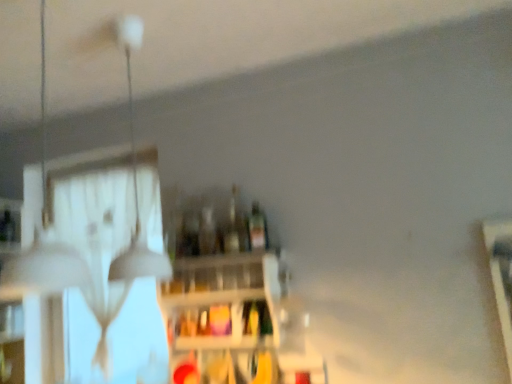
Looking at this image, what is the approximate width of white matte lampshade at upper left, which appears as the 1th lamp when viewed from the front?

Answer: The width of white matte lampshade at upper left, which appears as the 1th lamp when viewed from the front, is 9.92 inches.

The height and width of the screenshot is (384, 512). What do you see at coordinates (42, 270) in the screenshot? I see `white matte lampshade at upper left, which appears as the 1th lamp when viewed from the front` at bounding box center [42, 270].

In order to face transparent glass bottle at center, arranged as the second bottle when viewed from the right, should I rotate leftwards or rightwards?

It's best to rotate left around 2.896 degrees.

Describe the element at coordinates (234, 228) in the screenshot. This screenshot has width=512, height=384. I see `transparent glass bottle at center, acting as the 2th bottle starting from the left` at that location.

The height and width of the screenshot is (384, 512). I want to click on translucent glass bottle at center, positioned as the 3th bottle in left-to-right order, so click(257, 228).

The width and height of the screenshot is (512, 384). Describe the element at coordinates (257, 228) in the screenshot. I see `translucent glass bottle at center, which is counted as the first bottle, starting from the right` at that location.

What is the approximate height of transparent glass door at upper left?

3.78 feet.

The image size is (512, 384). Identify the location of white matte lampshade at upper left, the first lamp viewed from the back. coord(135,179).

In the scene shown: Is translucent glass bottle at center, which appears as the 3th bottle when viewed from the right, bigger or smaller than white matte lampshade at upper left, which is the 2th lamp from front to back?

In the image, translucent glass bottle at center, which appears as the 3th bottle when viewed from the right, appears to be smaller than white matte lampshade at upper left, which is the 2th lamp from front to back.

Could you tell me if translucent glass bottle at center, the 1th bottle when ordered from left to right, is turned towards white matte lampshade at upper left, the first lamp viewed from the back?

Yes, translucent glass bottle at center, the 1th bottle when ordered from left to right, faces towards white matte lampshade at upper left, the first lamp viewed from the back.

Between translucent glass bottle at center, the 1th bottle when ordered from left to right, and white matte lampshade at upper left, the first lamp viewed from the back, which one is positioned behind?

translucent glass bottle at center, the 1th bottle when ordered from left to right, is further away from the camera.

Can you tell me how much translucent glass bottle at center, the 1th bottle when ordered from left to right, and white matte lampshade at upper left, the first lamp viewed from the back, differ in facing direction?

82 degrees separate the facing orientations of translucent glass bottle at center, the 1th bottle when ordered from left to right, and white matte lampshade at upper left, the first lamp viewed from the back.

Could you tell me if translucent glass bottle at center, which is counted as the first bottle, starting from the right, is turned towards transparent glass door at upper left?

No, translucent glass bottle at center, which is counted as the first bottle, starting from the right, is not aimed at transparent glass door at upper left.

From a real-world perspective, is translucent glass bottle at center, which is counted as the first bottle, starting from the right, physically located above or below transparent glass door at upper left?

In terms of real-world spatial position, translucent glass bottle at center, which is counted as the first bottle, starting from the right, is above transparent glass door at upper left.

Considering the positions of objects translucent glass bottle at center, positioned as the 3th bottle in left-to-right order, and transparent glass door at upper left in the image provided, who is in front, translucent glass bottle at center, positioned as the 3th bottle in left-to-right order, or transparent glass door at upper left?

translucent glass bottle at center, positioned as the 3th bottle in left-to-right order, is more forward.

Considering the positions of points (266, 239) and (121, 369), is point (266, 239) farther from camera compared to point (121, 369)?

No.

Is matte yellow glass at center inside transparent glass door at upper left?

No, matte yellow glass at center is located outside of transparent glass door at upper left.

How distant is transparent glass door at upper left from matte yellow glass at center?

transparent glass door at upper left is 28.64 inches away from matte yellow glass at center.

Who is taller, transparent glass door at upper left or matte yellow glass at center?

transparent glass door at upper left.

Is transparent glass door at upper left oriented away from matte yellow glass at center?

No, transparent glass door at upper left is not facing the opposite direction of matte yellow glass at center.

Does white matte lampshade at upper left, which is the 2th lamp from front to back, turn towards translucent glass bottle at center, which is counted as the first bottle, starting from the right?

No, white matte lampshade at upper left, which is the 2th lamp from front to back, is not facing towards translucent glass bottle at center, which is counted as the first bottle, starting from the right.

How different are the orientations of white matte lampshade at upper left, which is the 2th lamp from front to back, and translucent glass bottle at center, which is counted as the first bottle, starting from the right, in degrees?

82 degrees separate the facing orientations of white matte lampshade at upper left, which is the 2th lamp from front to back, and translucent glass bottle at center, which is counted as the first bottle, starting from the right.

Considering the relative sizes of white matte lampshade at upper left, which is the 2th lamp from front to back, and translucent glass bottle at center, which is counted as the first bottle, starting from the right, in the image provided, is white matte lampshade at upper left, which is the 2th lamp from front to back, taller than translucent glass bottle at center, which is counted as the first bottle, starting from the right,?

Yes, white matte lampshade at upper left, which is the 2th lamp from front to back, is taller than translucent glass bottle at center, which is counted as the first bottle, starting from the right.

You are a GUI agent. You are given a task and a screenshot of the screen. Output one action in this format:
    pyautogui.click(x=<x>, y=<y>)
    Task: Click on the 2nd bottle behind when counting from the white matte lampshade at upper left, the first lamp viewed from the back
    This screenshot has height=384, width=512.
    Given the screenshot: What is the action you would take?
    pyautogui.click(x=257, y=228)

Considering their positions, is translucent glass bottle at center, positioned as the 3th bottle in left-to-right order, located in front of or behind matte yellow glass at center?

Visually, translucent glass bottle at center, positioned as the 3th bottle in left-to-right order, is located behind matte yellow glass at center.

Does translucent glass bottle at center, which is counted as the first bottle, starting from the right, have a greater width compared to matte yellow glass at center?

Correct, the width of translucent glass bottle at center, which is counted as the first bottle, starting from the right, exceeds that of matte yellow glass at center.

Which of these two, translucent glass bottle at center, positioned as the 3th bottle in left-to-right order, or matte yellow glass at center, is smaller?

With smaller size is matte yellow glass at center.

How many degrees apart are the facing directions of translucent glass bottle at center, positioned as the 3th bottle in left-to-right order, and matte yellow glass at center?

The angular difference between translucent glass bottle at center, positioned as the 3th bottle in left-to-right order, and matte yellow glass at center is 4.42 degrees.

Is transparent glass door at upper left bigger or smaller than white matte lampshade at upper left, the first lamp viewed from the back?

Considering their sizes, transparent glass door at upper left takes up more space than white matte lampshade at upper left, the first lamp viewed from the back.

Between transparent glass door at upper left and white matte lampshade at upper left, the first lamp viewed from the back, which one has more height?

transparent glass door at upper left.

From a real-world perspective, is transparent glass door at upper left positioned under white matte lampshade at upper left, which is the 2th lamp from front to back, based on gravity?

Correct, in the physical world, transparent glass door at upper left is lower than white matte lampshade at upper left, which is the 2th lamp from front to back.

Is transparent glass door at upper left inside the boundaries of white matte lampshade at upper left, the first lamp viewed from the back, or outside?

transparent glass door at upper left is not inside white matte lampshade at upper left, the first lamp viewed from the back, it's outside.

Choose the correct answer: Is white matte lampshade at upper left, which appears as the 1th lamp when viewed from the front, inside translucent glass bottle at center, the 1th bottle when ordered from left to right, or outside it?

white matte lampshade at upper left, which appears as the 1th lamp when viewed from the front, is outside translucent glass bottle at center, the 1th bottle when ordered from left to right.

This screenshot has height=384, width=512. I want to click on the 1st bottle to the right of the white matte lampshade at upper left, which appears as the 1th lamp when viewed from the front, starting your count from the anchor, so click(207, 232).

Considering the relative sizes of white matte lampshade at upper left, which appears as the 1th lamp when viewed from the front, and translucent glass bottle at center, which appears as the 3th bottle when viewed from the right, in the image provided, is white matte lampshade at upper left, which appears as the 1th lamp when viewed from the front, smaller than translucent glass bottle at center, which appears as the 3th bottle when viewed from the right,?

Incorrect, white matte lampshade at upper left, which appears as the 1th lamp when viewed from the front, is not smaller in size than translucent glass bottle at center, which appears as the 3th bottle when viewed from the right.

From a real-world perspective, which object stands above the other?

white matte lampshade at upper left, arranged as the 2th lamp when viewed from the back.

At what (x,y) coordinates should I click in order to perform the action: click on bottle that is the 1st one when counting rightward from the white matte lampshade at upper left, the first lamp viewed from the back. Please return your answer as a coordinate pair (x, y). Looking at the image, I should click on (207, 232).

Which bottle is the 2nd one when counting from the front of the transparent glass door at upper left? Please provide its 2D coordinates.

[(257, 228)]

Estimate the real-world distances between objects in this image. Which object is further from transparent glass door at upper left, matte yellow glass at center or wooden shelf at center?

matte yellow glass at center lies further to transparent glass door at upper left than the other object.

From the image, which object appears to be nearer to wooden shelf at center, white matte lampshade at upper left, which appears as the 1th lamp when viewed from the front, or matte yellow glass at center?

matte yellow glass at center lies closer to wooden shelf at center than the other object.

From the picture: Estimate the real-world distances between objects in this image. Which object is further from translucent glass bottle at center, which appears as the 3th bottle when viewed from the right, wooden shelf at center or transparent glass bottle at center, acting as the 2th bottle starting from the left?

The object further to translucent glass bottle at center, which appears as the 3th bottle when viewed from the right, is wooden shelf at center.

Considering their positions, is white matte lampshade at upper left, the first lamp viewed from the back, positioned closer to transparent glass door at upper left than matte yellow glass at center?

Among the two, white matte lampshade at upper left, the first lamp viewed from the back, is located nearer to transparent glass door at upper left.

When comparing their distances from white matte lampshade at upper left, which appears as the 1th lamp when viewed from the front, does matte yellow glass at center or wooden shelf at center seem further?

The object further to white matte lampshade at upper left, which appears as the 1th lamp when viewed from the front, is matte yellow glass at center.

Estimate the real-world distances between objects in this image. Which object is closer to transparent glass bottle at center, arranged as the second bottle when viewed from the right, translucent glass bottle at center, which is counted as the first bottle, starting from the right, or matte yellow glass at center?

Based on the image, translucent glass bottle at center, which is counted as the first bottle, starting from the right, appears to be nearer to transparent glass bottle at center, arranged as the second bottle when viewed from the right.

From the image, which object appears to be nearer to wooden shelf at center, matte yellow glass at center or transparent glass bottle at center, acting as the 2th bottle starting from the left?

Based on the image, matte yellow glass at center appears to be nearer to wooden shelf at center.

From the picture: Considering their positions, is transparent glass bottle at center, acting as the 2th bottle starting from the left, positioned further to translucent glass bottle at center, the 1th bottle when ordered from left to right, than white matte lampshade at upper left, which appears as the 1th lamp when viewed from the front?

white matte lampshade at upper left, which appears as the 1th lamp when viewed from the front, is positioned further to the anchor translucent glass bottle at center, the 1th bottle when ordered from left to right.

You are a GUI agent. You are given a task and a screenshot of the screen. Output one action in this format:
    pyautogui.click(x=<x>, y=<y>)
    Task: Click on the shelf between white matte lampshade at upper left, which is the 2th lamp from front to back, and matte yellow glass at center from top to bottom
    This screenshot has width=512, height=384.
    Given the screenshot: What is the action you would take?
    [223, 304]

I want to click on bottle between translucent glass bottle at center, positioned as the 3th bottle in left-to-right order, and matte yellow glass at center in the up-down direction, so pos(207,232).

In order to click on bottle between translucent glass bottle at center, which is counted as the first bottle, starting from the right, and wooden shelf at center from top to bottom in this screenshot , I will do `click(207, 232)`.

Find the location of `lamp between white matte lampshade at upper left, which appears as the 1th lamp when viewed from the front, and transparent glass door at upper left in the front-back direction`. lamp between white matte lampshade at upper left, which appears as the 1th lamp when viewed from the front, and transparent glass door at upper left in the front-back direction is located at coordinates (135, 179).